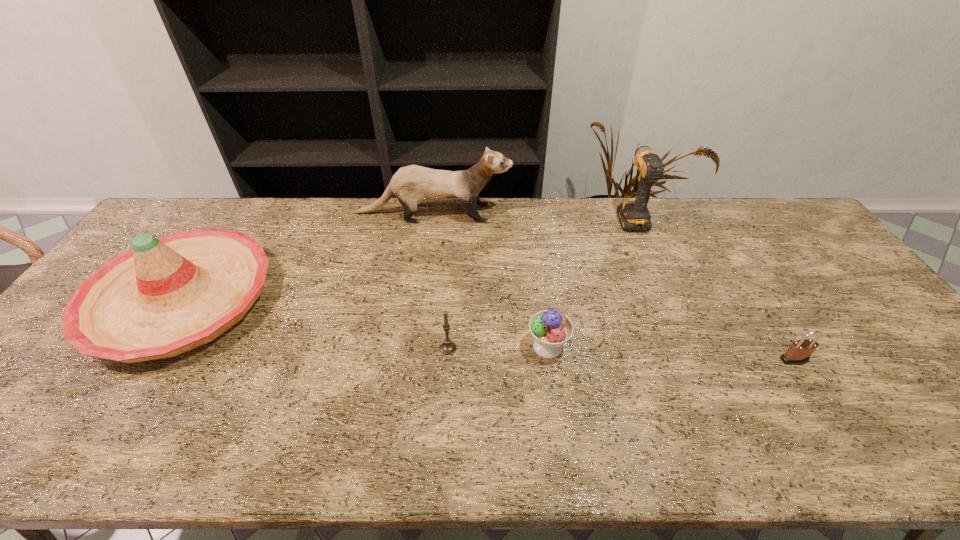
At what (x,y) coordinates should I click in order to perform the action: click on vacant space that is in between the icecream and the rightmost object. Please return your answer as a coordinate pair (x, y). This screenshot has width=960, height=540. Looking at the image, I should click on (671, 353).

The image size is (960, 540). Identify the location of vacant region between the fourth object from left to right and the ferret. (491, 280).

Find the location of a particular element. This screenshot has width=960, height=540. empty space between the icecream and the ferret is located at coordinates (491, 280).

Where is `vacant area that lies between the rightmost object and the icecream`? The height and width of the screenshot is (540, 960). vacant area that lies between the rightmost object and the icecream is located at coordinates (671, 353).

In order to click on free spot between the drill and the leftmost object in this screenshot , I will do `click(406, 258)`.

Locate an element on the screen. This screenshot has height=540, width=960. free point between the ferret and the icecream is located at coordinates (491, 280).

You are a GUI agent. You are given a task and a screenshot of the screen. Output one action in this format:
    pyautogui.click(x=<x>, y=<y>)
    Task: Click on the vacant space in between the candle and the third object from right to left
    This screenshot has height=540, width=960.
    Given the screenshot: What is the action you would take?
    pyautogui.click(x=498, y=347)

Find the location of a particular element. The height and width of the screenshot is (540, 960). free spot between the ferret and the leftmost object is located at coordinates (307, 256).

Where is `empty space that is in between the candle and the leftmost object`? empty space that is in between the candle and the leftmost object is located at coordinates coord(315,324).

Identify the location of free space between the fifth object from left to right and the padlock. (712, 288).